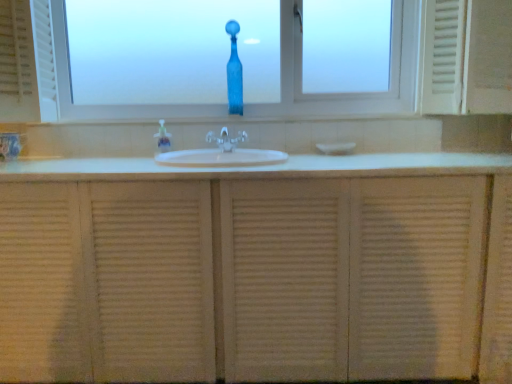
Question: Should I look upward or downward to see white textured medicine cabinet at right?

Choices:
 (A) up
 (B) down

Answer: (A)

Question: Should I look upward or downward to see translucent plastic soap dispenser at center?

Choices:
 (A) down
 (B) up

Answer: (B)

Question: Is white textured cabinet at center in contact with transparent glass window at center?

Choices:
 (A) no
 (B) yes

Answer: (A)

Question: Considering the relative sizes of white textured cabinet at center and transparent glass window at center in the image provided, is white textured cabinet at center shorter than transparent glass window at center?

Choices:
 (A) no
 (B) yes

Answer: (A)

Question: From a real-world perspective, is white textured cabinet at center on top of transparent glass window at center?

Choices:
 (A) yes
 (B) no

Answer: (B)

Question: From the image's perspective, would you say white textured cabinet at center is positioned over transparent glass window at center?

Choices:
 (A) no
 (B) yes

Answer: (A)

Question: Does white textured cabinet at center have a lesser width compared to transparent glass window at center?

Choices:
 (A) no
 (B) yes

Answer: (A)

Question: Is transparent glass window at center inside white textured cabinet at center?

Choices:
 (A) yes
 (B) no

Answer: (B)

Question: Does clear plastic faucet at center have a lesser height compared to white ceramic sink at center?

Choices:
 (A) no
 (B) yes

Answer: (B)

Question: Considering the relative sizes of clear plastic faucet at center and white ceramic sink at center in the image provided, is clear plastic faucet at center taller than white ceramic sink at center?

Choices:
 (A) no
 (B) yes

Answer: (A)

Question: Considering the relative sizes of clear plastic faucet at center and white ceramic sink at center in the image provided, is clear plastic faucet at center wider than white ceramic sink at center?

Choices:
 (A) no
 (B) yes

Answer: (A)

Question: Is clear plastic faucet at center positioned behind white ceramic sink at center?

Choices:
 (A) no
 (B) yes

Answer: (B)

Question: Is clear plastic faucet at center outside of white ceramic sink at center?

Choices:
 (A) no
 (B) yes

Answer: (B)

Question: Is clear plastic faucet at center looking in the opposite direction of white ceramic sink at center?

Choices:
 (A) yes
 (B) no

Answer: (B)

Question: Does white textured cabinet at center touch translucent plastic soap dispenser at center?

Choices:
 (A) no
 (B) yes

Answer: (A)